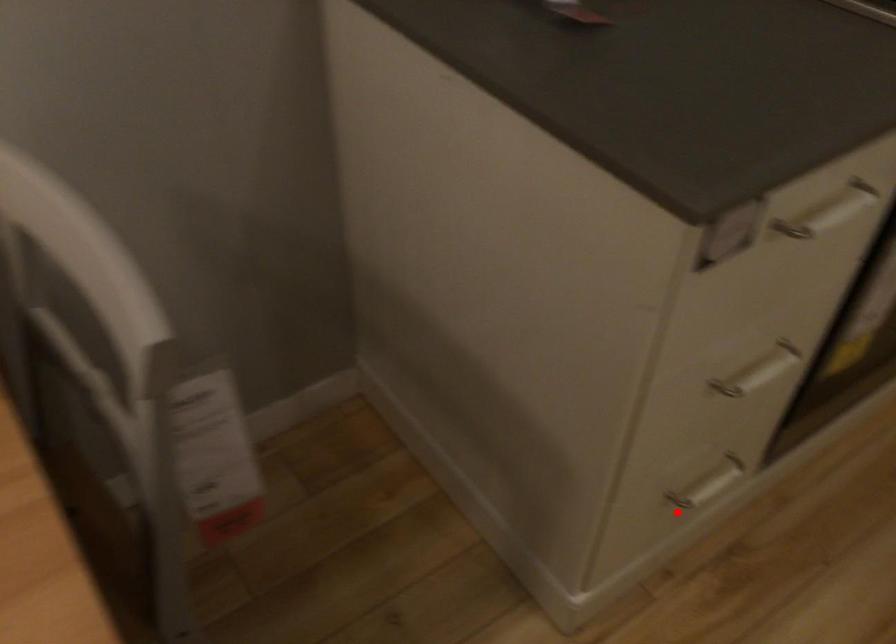
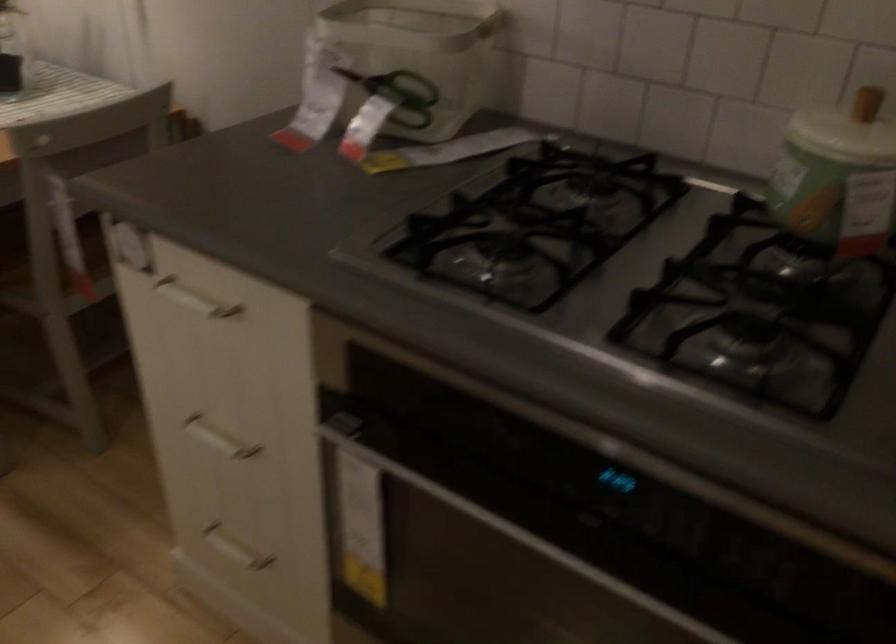
Question: A red point is marked in image1. In image2, is the corresponding 3D point closer to the camera or farther? Reply with the corresponding letter.

Choices:
 (A) The corresponding 3D point is closer.
 (B) The corresponding 3D point is farther.

Answer: (B)